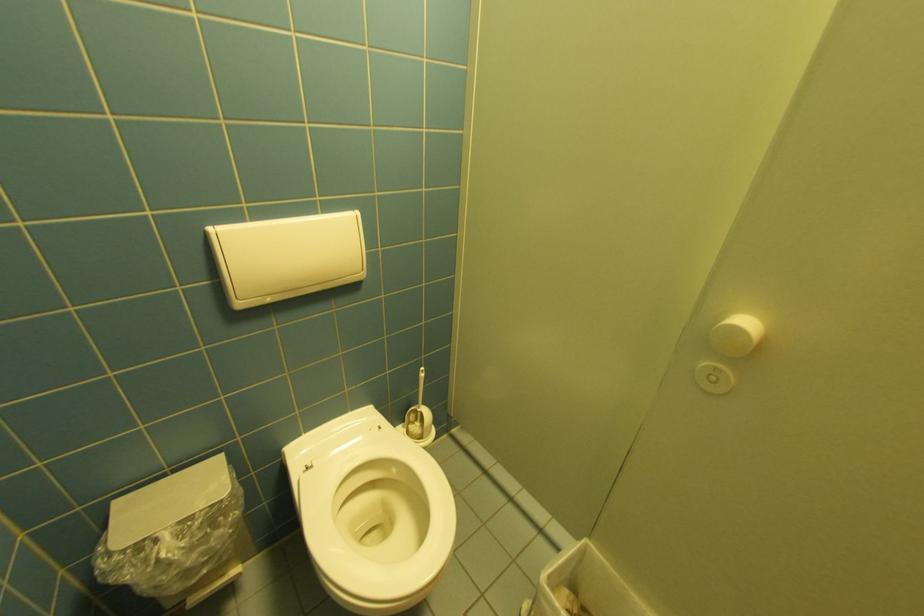
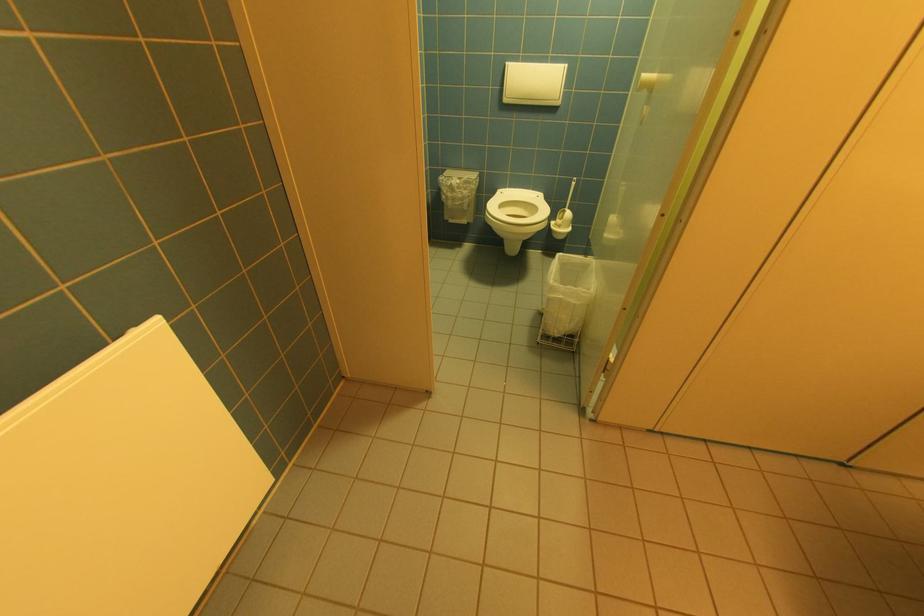
Where in the second image is the point corresponding to point (419, 416) from the first image?

(567, 215)